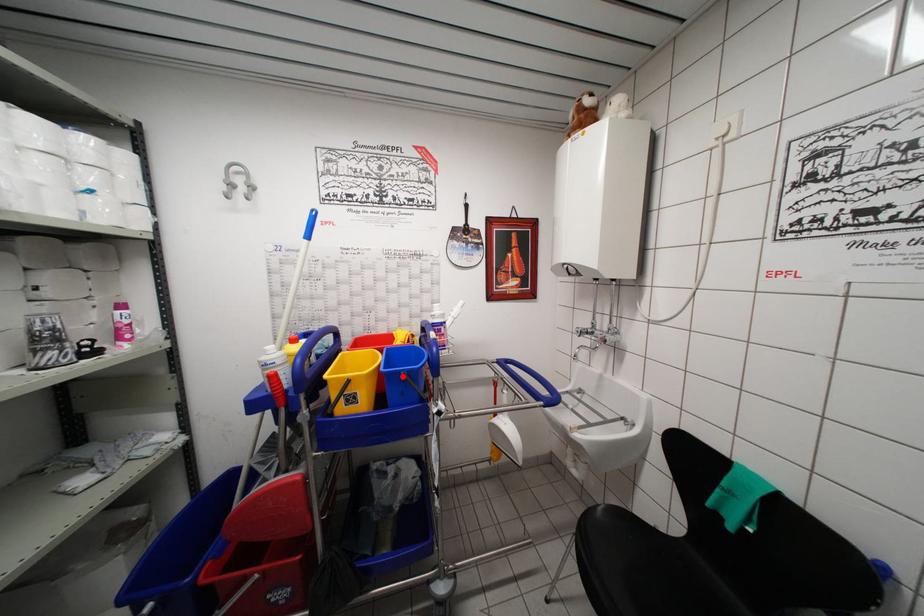
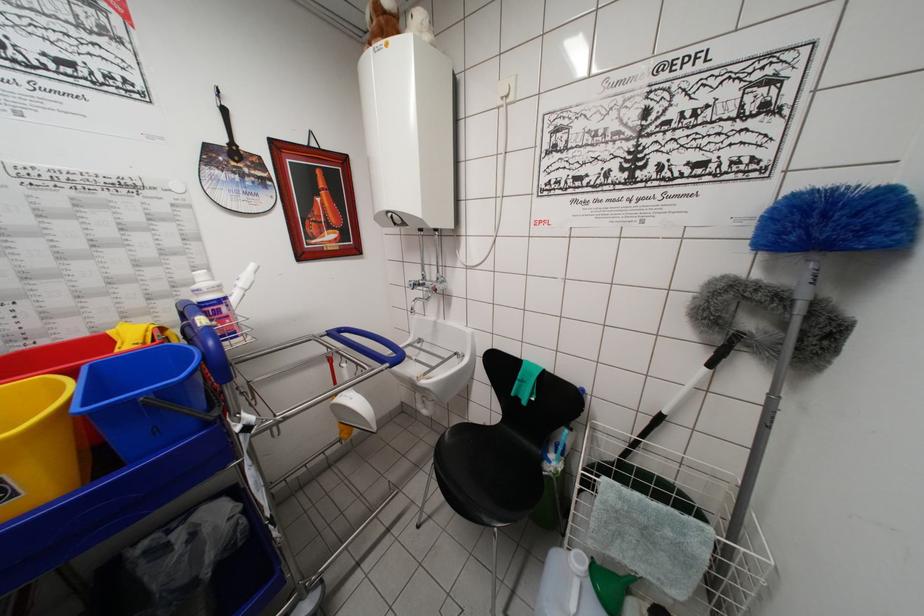
Where in the second image is the point corresponding to the highlighted location from the first image?

(136, 405)